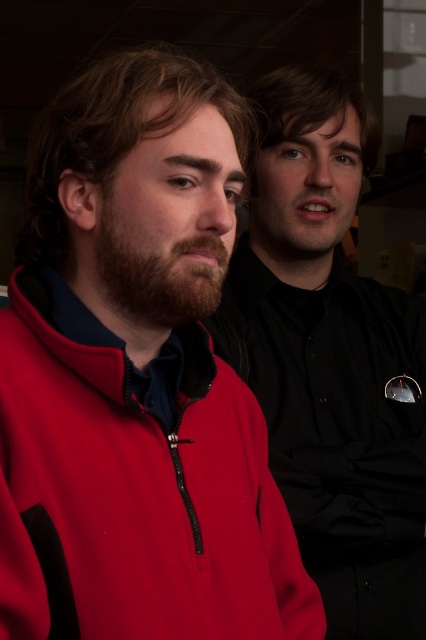
In the scene shown: You are a tailor measuring jackets for alterations. You have a customer who wants to know if their two jackets, the matte fleece jacket at left and the matte red jacket at left, can be placed side by side on a 20 inch wide tailor table. Can they fit?

The matte fleece jacket at left and the matte red jacket at left are 17.51 inches apart, so they can be placed side by side on a 20 inch wide tailor table since the combined width is less than the table.

You are trying to determine which of the two jackets is smaller in size based on their appearance in the image. The scene shows two people standing close together indoors. The first person wears a matte fleece jacket at left with black accents, and the second person has a matte red jacket at left. Which jacket takes up less visual space in the image?

The matte fleece jacket at left occupies less space than the matte red jacket at left, so the matte fleece jacket at left is the smaller one in terms of visual space.

You are standing in front of the two people in the image. You need to determine which of the two points, point (20, 468) or point (333, 541), is closer to you. Which one is closer?

Point (20, 468) is closer to the viewer than point (333, 541).